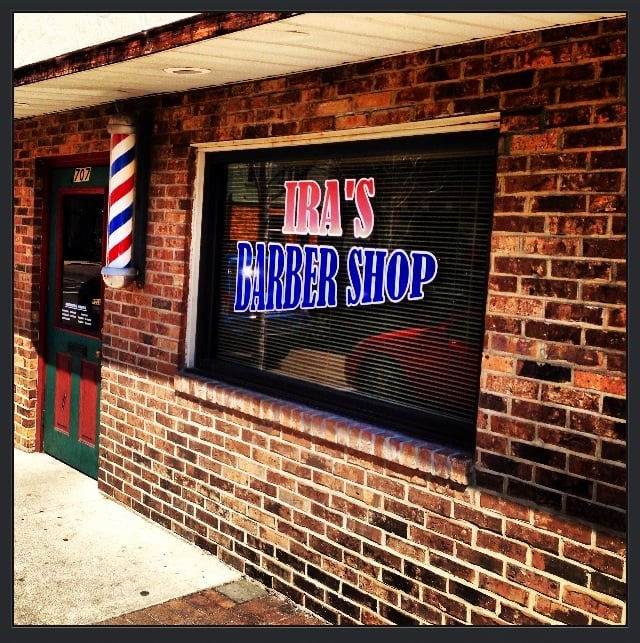
Locate an element on the screen. ceiling light is located at coordinates (182, 69).